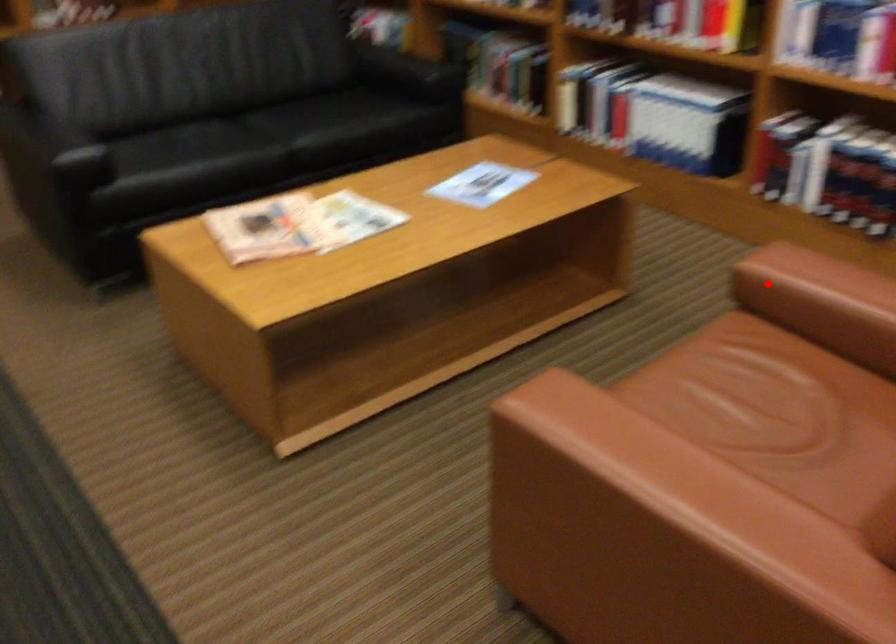
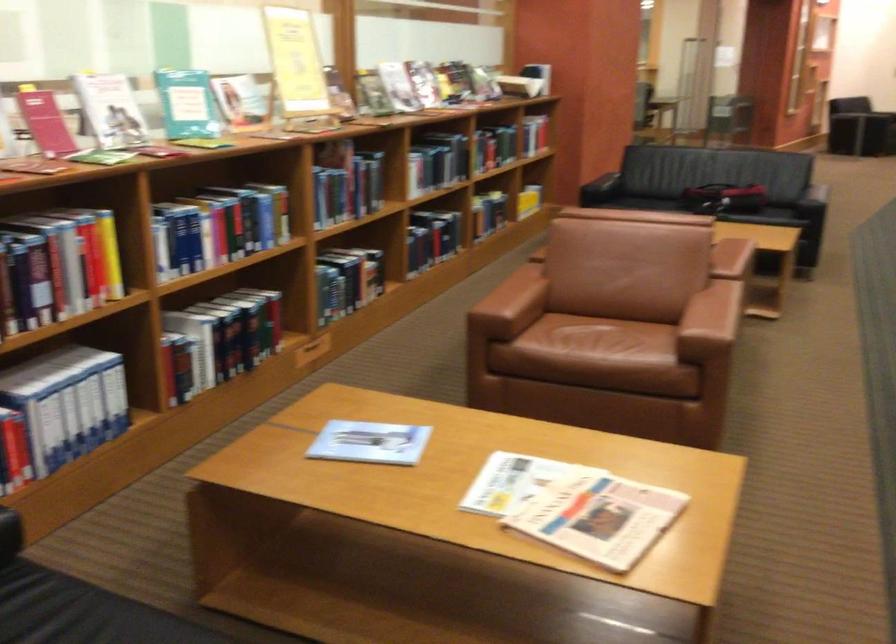
Question: I am providing you with two images of the same scene from different viewpoints. Given a red point in image1, look at the same physical point in image2. Is it:

Choices:
 (A) Closer to the viewpoint
 (B) Farther from the viewpoint

Answer: (B)